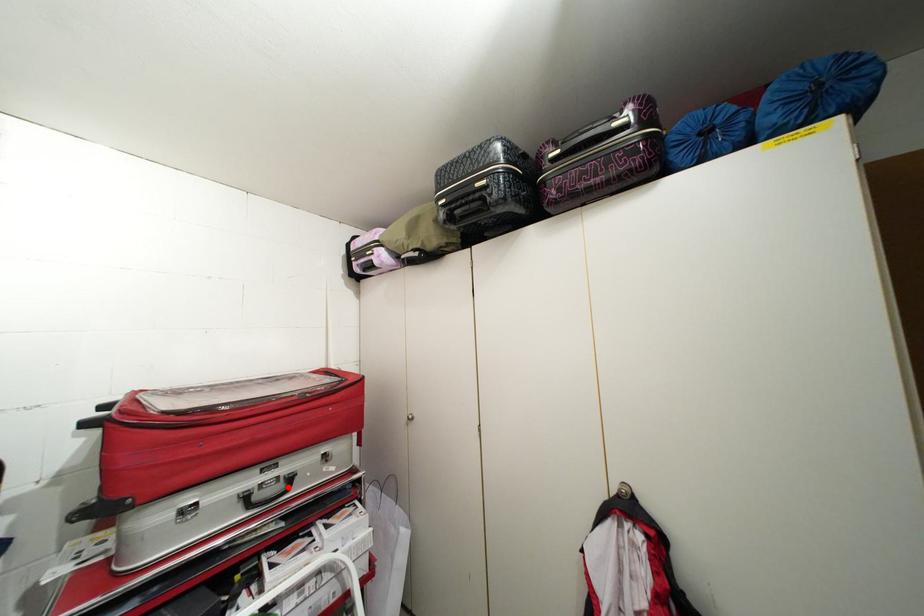
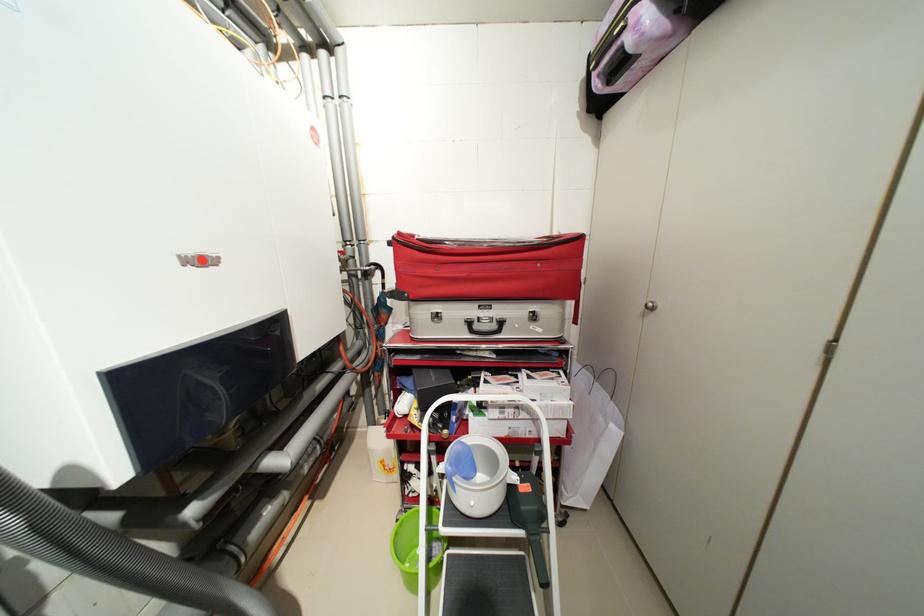
Question: I am providing you with two images of the same scene from different viewpoints. A red point is marked on the first image. Is the red point's position out of view in image 2?

Choices:
 (A) Yes
 (B) No

Answer: (B)